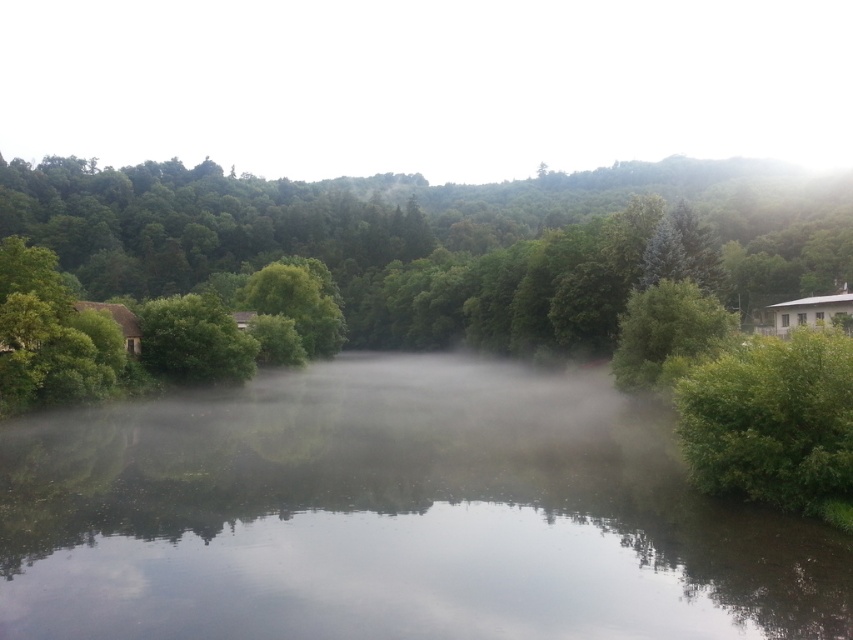
Is transparent misty river at center to the right of green matte tree at center from the viewer's perspective?

Indeed, transparent misty river at center is positioned on the right side of green matte tree at center.

Can you confirm if transparent misty river at center is smaller than green matte tree at center?

Incorrect, transparent misty river at center is not smaller in size than green matte tree at center.

You are a GUI agent. You are given a task and a screenshot of the screen. Output one action in this format:
    pyautogui.click(x=<x>, y=<y>)
    Task: Click on the transparent misty river at center
    The image size is (853, 640).
    Given the screenshot: What is the action you would take?
    pyautogui.click(x=393, y=516)

Is green leafy tree at center right thinner than green matte tree at center?

Yes, green leafy tree at center right is thinner than green matte tree at center.

Is point (646, 296) positioned behind point (194, 346)?

No, it is not.

Identify the location of green leafy tree at center right. This screenshot has height=640, width=853. [668, 333].

Is point (810, 460) closer to viewer compared to point (726, 326)?

Yes, point (810, 460) is closer to viewer.

Between point (782, 488) and point (683, 321), which one is positioned in front?

Positioned in front is point (782, 488).

The image size is (853, 640). What are the coordinates of `green leafy bush at right` in the screenshot? It's located at (772, 420).